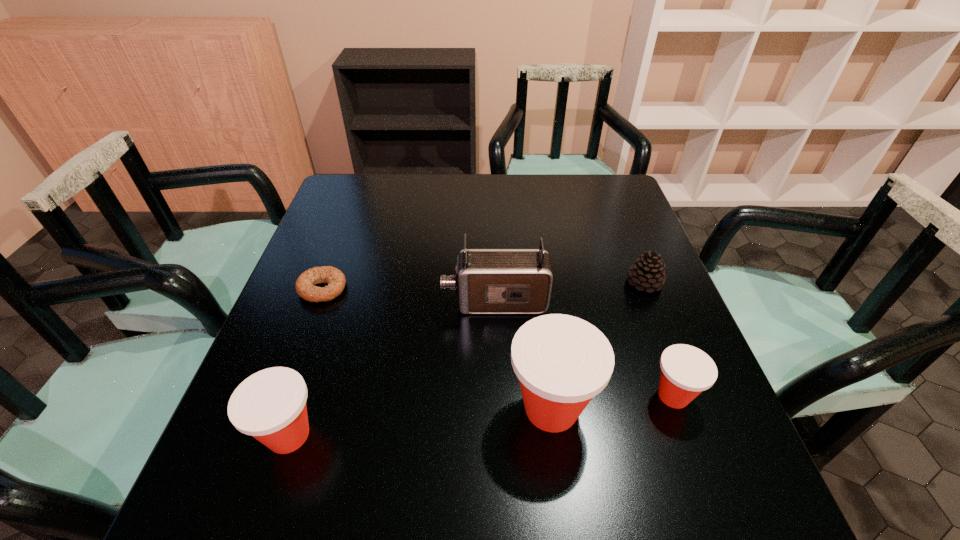
Locate an element on the screen. The width and height of the screenshot is (960, 540). Dixie cup that is the second closest to the camcorder is located at coordinates [x=686, y=371].

The height and width of the screenshot is (540, 960). I want to click on free space that satisfies the following two spatial constraints: 1. at the lens of the second Dixie cup from right to left; 2. on the left side of the camcorder, so click(x=499, y=408).

This screenshot has height=540, width=960. I want to click on vacant space that satisfies the following two spatial constraints: 1. on the back side of the fourth shortest object; 2. on the right side of the tallest Dixie cup, so click(x=298, y=408).

Where is `free space in the image that satisfies the following two spatial constraints: 1. at the lens of the shortest Dixie cup; 2. on the right side of the camcorder`? This screenshot has height=540, width=960. free space in the image that satisfies the following two spatial constraints: 1. at the lens of the shortest Dixie cup; 2. on the right side of the camcorder is located at coordinates (498, 396).

Where is `vacant area that satisfies the following two spatial constraints: 1. at the lens of the tallest Dixie cup; 2. on the right side of the camcorder`? The image size is (960, 540). vacant area that satisfies the following two spatial constraints: 1. at the lens of the tallest Dixie cup; 2. on the right side of the camcorder is located at coordinates (499, 408).

Locate an element on the screen. vacant space that satisfies the following two spatial constraints: 1. at the lens of the camcorder; 2. on the front side of the second shortest Dixie cup is located at coordinates (499, 435).

Locate an element on the screen. free space that satisfies the following two spatial constraints: 1. on the back side of the shortest Dixie cup; 2. on the left side of the tallest Dixie cup is located at coordinates (549, 396).

Find the location of `free location that satisfies the following two spatial constraints: 1. on the front side of the second tallest Dixie cup; 2. on the left side of the bagel`. free location that satisfies the following two spatial constraints: 1. on the front side of the second tallest Dixie cup; 2. on the left side of the bagel is located at coordinates (268, 435).